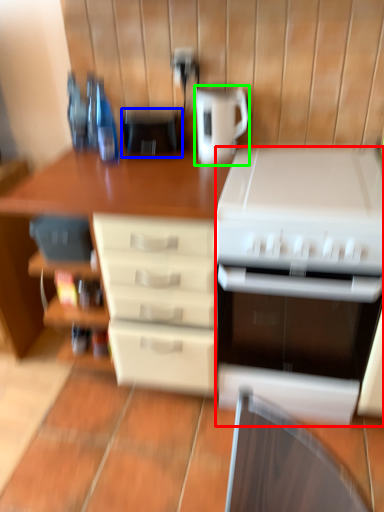
Question: Estimate the real-world distances between objects in this image. Which object is closer to kitchen appliance (highlighted by a red box), appliance (highlighted by a blue box) or kitchen appliance (highlighted by a green box)?

Choices:
 (A) appliance
 (B) kitchen appliance

Answer: (B)